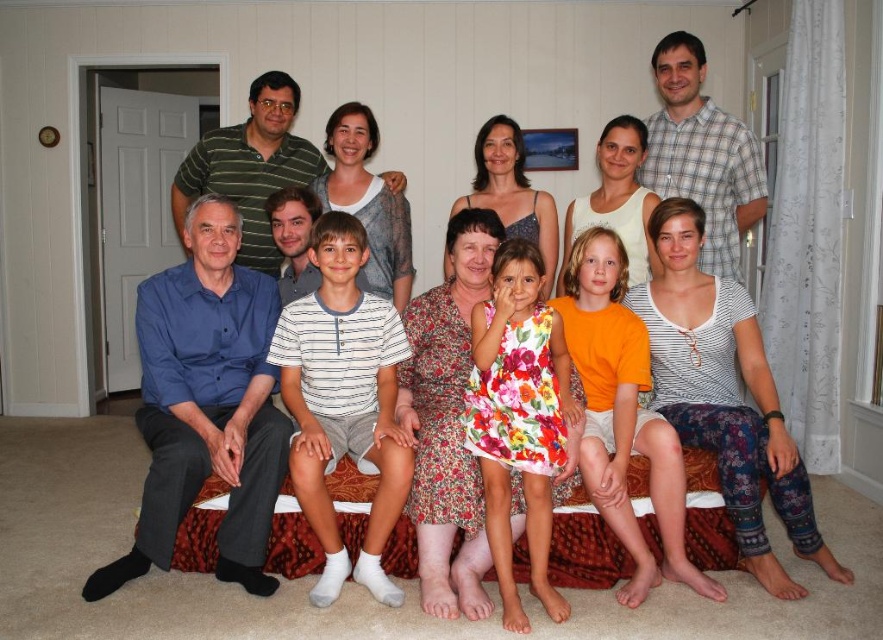
Question: Where is white striped shirt at center located in relation to floral cotton dress at center in the image?

Choices:
 (A) right
 (B) left

Answer: (B)

Question: Which of the following is the closest to the observer?

Choices:
 (A) white striped shirt at center
 (B) floral cotton dress at center

Answer: (B)

Question: Does white striped shirt at center have a larger size compared to floral cotton dress at center?

Choices:
 (A) no
 (B) yes

Answer: (B)

Question: Which object appears farthest from the camera in this image?

Choices:
 (A) white striped shirt at center
 (B) floral cotton dress at center

Answer: (A)

Question: Can you confirm if white striped shirt at center is smaller than floral cotton dress at center?

Choices:
 (A) yes
 (B) no

Answer: (B)

Question: Which object appears farthest from the camera in this image?

Choices:
 (A) floral cotton dress at center
 (B) white striped shirt at center

Answer: (B)